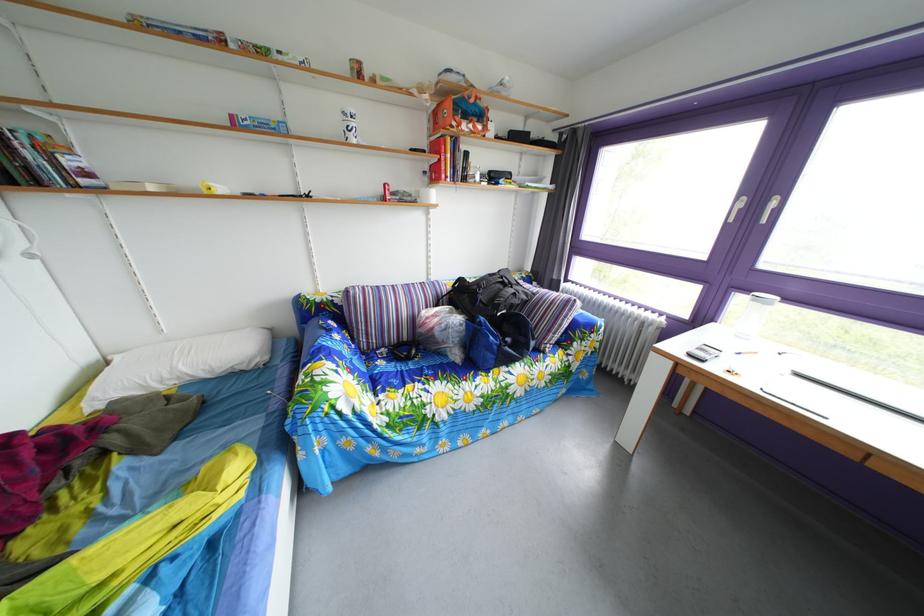
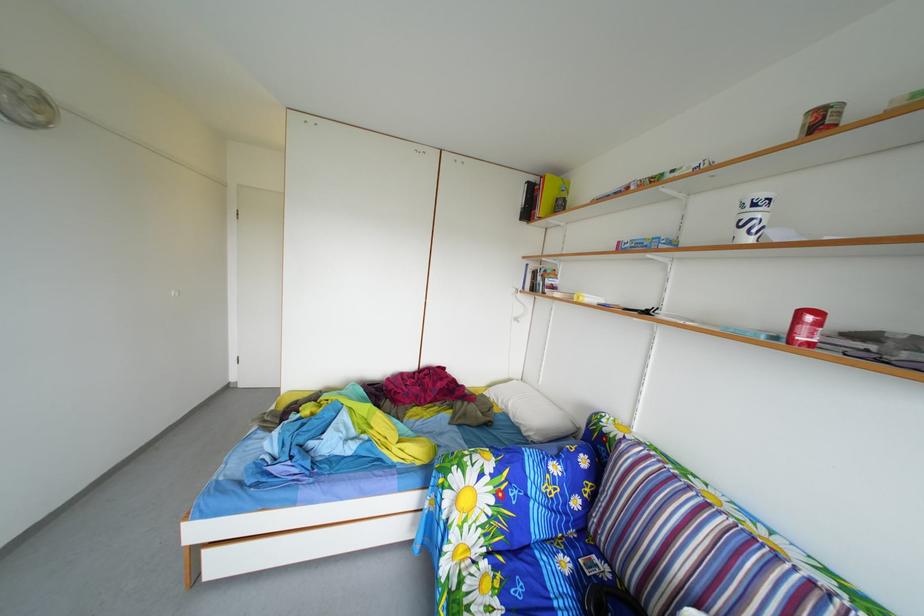
The point at (362, 126) is marked in the first image. Where is the corresponding point in the second image?

(766, 214)